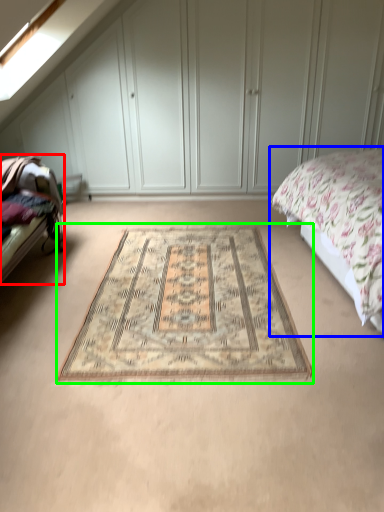
Question: Based on their relative distances, which object is farther from bed frame (highlighted by a red box)? Choose from bed (highlighted by a blue box) and mat (highlighted by a green box).

Choices:
 (A) bed
 (B) mat

Answer: (A)